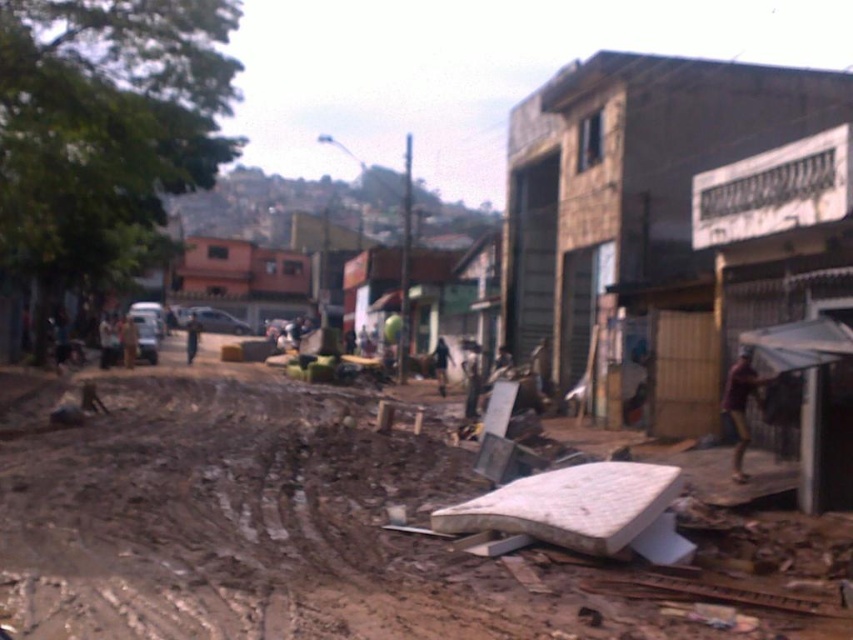
Does dark skin human at center appear on the right side of brown leather jacket at center?

Indeed, dark skin human at center is positioned on the right side of brown leather jacket at center.

Who is higher up, dark skin human at center or brown leather jacket at center?

brown leather jacket at center

What do you see at coordinates (440, 364) in the screenshot? I see `dark skin human at center` at bounding box center [440, 364].

The width and height of the screenshot is (853, 640). Identify the location of dark skin human at center. (440, 364).

Who is more forward, (47,484) or (189,339)?

Point (47,484) is more forward.

Describe the element at coordinates (325, 534) in the screenshot. I see `brown dirt at lower center` at that location.

This screenshot has width=853, height=640. What are the coordinates of `brown dirt at lower center` in the screenshot? It's located at (325, 534).

Who is more forward, (732, 371) or (190, 348)?

Point (732, 371)

Based on the photo, which is more to the right, brown fabric shirt at right or brown leather jacket at center?

brown fabric shirt at right is more to the right.

Who is more distant from viewer, (737,385) or (189,344)?

The point (189,344) is behind.

Locate an element on the screen. brown fabric shirt at right is located at coordinates (741, 403).